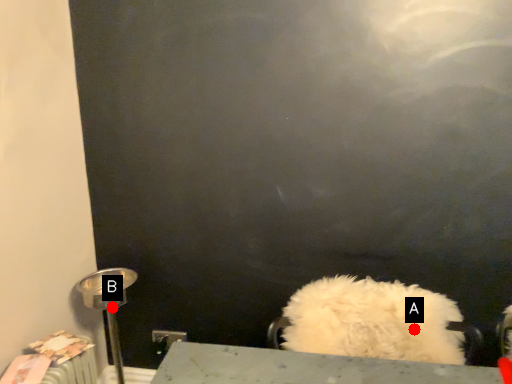
Question: Two points are circled on the image, labeled by A and B beside each circle. Which point is farther to the camera?

Choices:
 (A) A is further
 (B) B is further

Answer: (B)